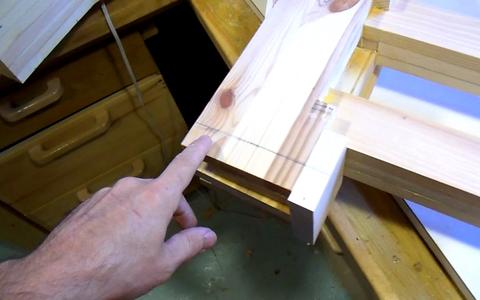
Where is `drawer handles`? The width and height of the screenshot is (480, 300). drawer handles is located at coordinates (44, 97), (72, 143), (85, 195), (332, 245).